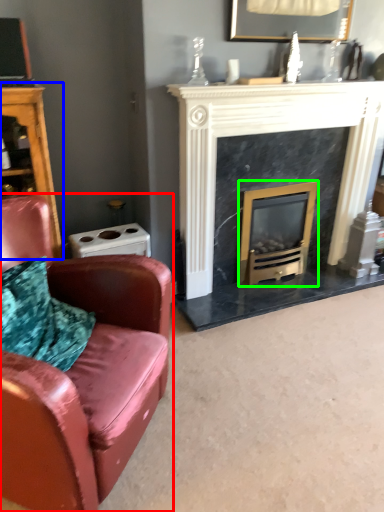
Question: Considering the real-world distances, which object is farthest from chair (highlighted by a red box)? dresser (highlighted by a blue box) or wood burning stove (highlighted by a green box)?

Choices:
 (A) dresser
 (B) wood burning stove

Answer: (B)